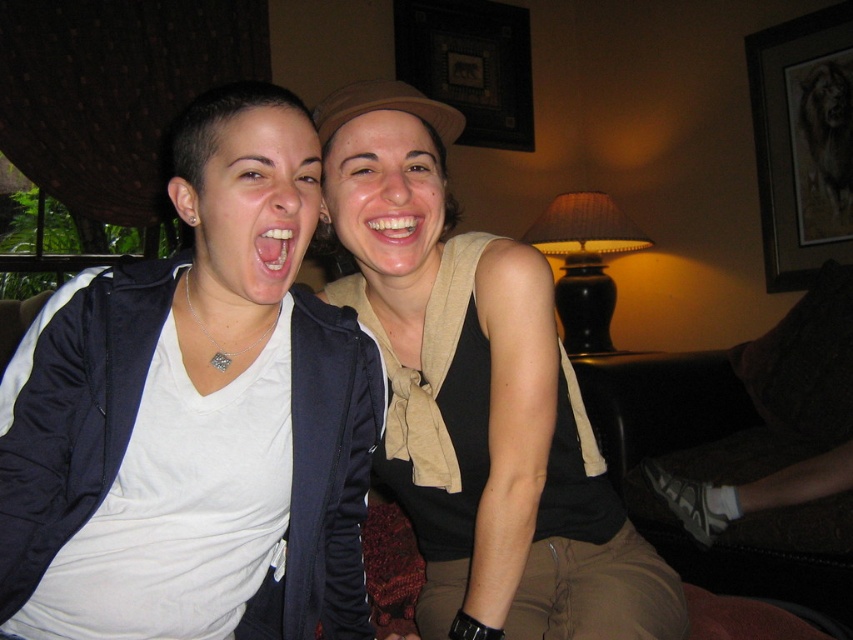
Consider the image. Which of these two, white matte shirt at center or white glossy teeth at center, stands taller?

white matte shirt at center

Is white matte shirt at center taller than white glossy teeth at center?

Yes.

Is point (485, 442) farther from viewer compared to point (293, 250)?

Yes, it is.

Locate an element on the screen. white matte shirt at center is located at coordinates (479, 397).